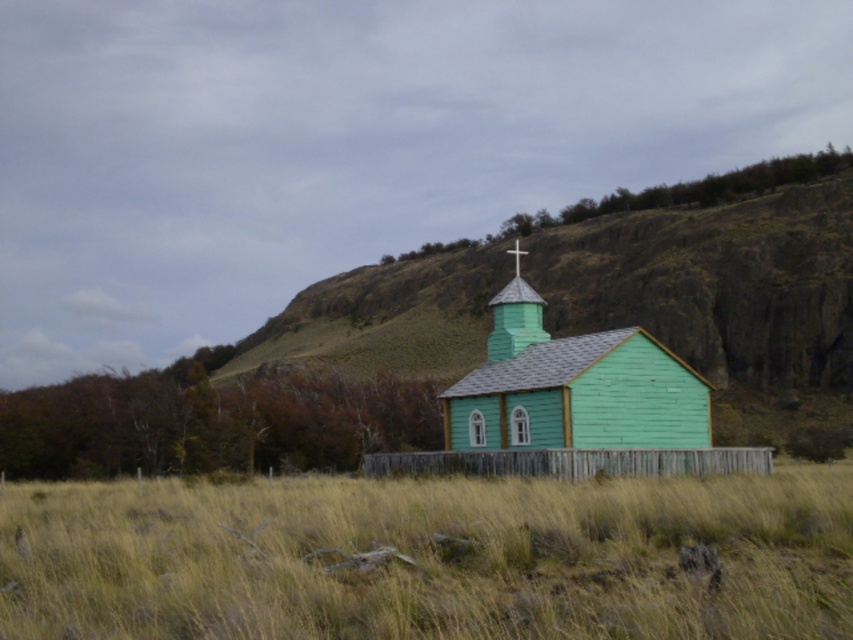
Describe the element at coordinates (428, 557) in the screenshot. I see `green grass at center` at that location.

Who is lower down, green grass at center or green wooden church at center?

green grass at center

Measure the distance between point (x=270, y=531) and camera.

Point (x=270, y=531) and camera are 14.23 meters apart from each other.

Locate an element on the screen. green grass at center is located at coordinates (428, 557).